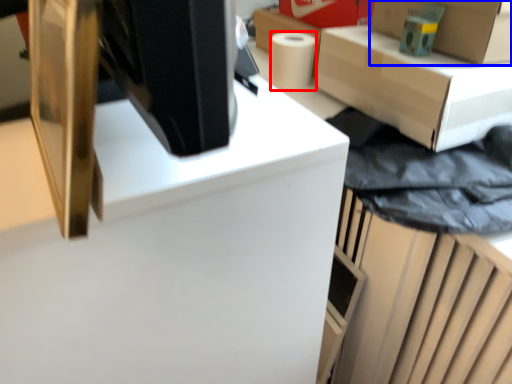
Question: Which point is further to the camera, paper towel (highlighted by a red box) or box (highlighted by a blue box)?

Choices:
 (A) paper towel
 (B) box

Answer: (A)